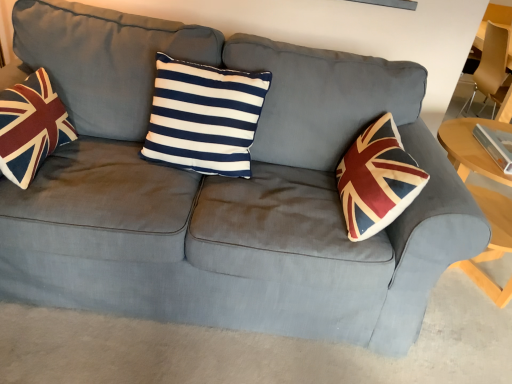
Question: Is the position of velvet union jack pillow at left less distant than that of navy/white striped cushion at center?

Choices:
 (A) yes
 (B) no

Answer: (A)

Question: Is velvet union jack pillow at left bigger than navy/white striped cushion at center?

Choices:
 (A) no
 (B) yes

Answer: (A)

Question: From the image's perspective, is velvet union jack pillow at left located beneath navy/white striped cushion at center?

Choices:
 (A) no
 (B) yes

Answer: (B)

Question: From the image's perspective, does velvet union jack pillow at left appear higher than navy/white striped cushion at center?

Choices:
 (A) no
 (B) yes

Answer: (A)

Question: Considering the relative sizes of velvet union jack pillow at left and navy/white striped cushion at center in the image provided, is velvet union jack pillow at left thinner than navy/white striped cushion at center?

Choices:
 (A) no
 (B) yes

Answer: (A)

Question: Does velvet union jack pillow at left have a greater height compared to navy/white striped cushion at center?

Choices:
 (A) yes
 (B) no

Answer: (B)

Question: Would you say velvet union jack pillow at left contains matte brown armchair at right?

Choices:
 (A) no
 (B) yes

Answer: (A)

Question: Is velvet union jack pillow at left bigger than matte brown armchair at right?

Choices:
 (A) yes
 (B) no

Answer: (B)

Question: Does velvet union jack pillow at left have a greater height compared to matte brown armchair at right?

Choices:
 (A) yes
 (B) no

Answer: (B)

Question: From a real-world perspective, is velvet union jack pillow at left located higher than matte brown armchair at right?

Choices:
 (A) no
 (B) yes

Answer: (A)

Question: Can you confirm if velvet union jack pillow at left is thinner than matte brown armchair at right?

Choices:
 (A) yes
 (B) no

Answer: (A)

Question: Does velvet union jack pillow at left come behind matte brown armchair at right?

Choices:
 (A) no
 (B) yes

Answer: (A)

Question: Is light wood table at right thinner than navy/white striped cushion at center?

Choices:
 (A) yes
 (B) no

Answer: (B)